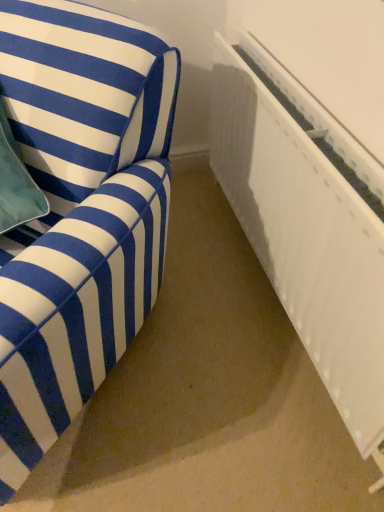
Question: Considering the positions of point (312, 261) and point (157, 90), is point (312, 261) closer or farther from the camera than point (157, 90)?

Choices:
 (A) closer
 (B) farther

Answer: (B)

Question: In the image, is white plastic radiator at right on the left side or the right side of blue striped fabric sofa at left?

Choices:
 (A) left
 (B) right

Answer: (B)

Question: Looking at the image, does white plastic radiator at right seem bigger or smaller compared to blue striped fabric sofa at left?

Choices:
 (A) big
 (B) small

Answer: (B)

Question: From a real-world perspective, is blue striped fabric sofa at left positioned above or below white plastic radiator at right?

Choices:
 (A) below
 (B) above

Answer: (B)

Question: Looking at the image, does blue striped fabric sofa at left seem bigger or smaller compared to white plastic radiator at right?

Choices:
 (A) small
 (B) big

Answer: (B)

Question: In the image, is blue striped fabric sofa at left positioned in front of or behind white plastic radiator at right?

Choices:
 (A) behind
 (B) front

Answer: (B)

Question: In terms of height, does blue striped fabric sofa at left look taller or shorter compared to white plastic radiator at right?

Choices:
 (A) tall
 (B) short

Answer: (A)